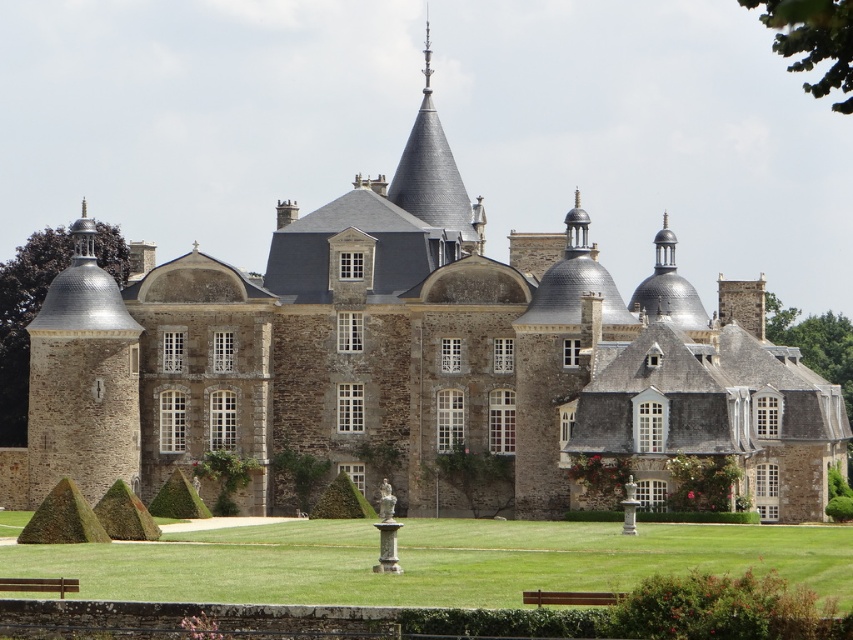
Is green leafy hedge at center to the left of brown wooden bench at lower center from the viewer's perspective?

Yes, green leafy hedge at center is to the left of brown wooden bench at lower center.

Looking at this image, who is more distant from viewer, (343, 472) or (584, 598)?

Point (343, 472)

Where is `green leafy hedge at center`? This screenshot has height=640, width=853. green leafy hedge at center is located at coordinates (341, 500).

Is brown wooden bench at lower center positioned before brown wooden bench at lower left?

Yes, brown wooden bench at lower center is closer to the viewer.

Which is above, brown wooden bench at lower center or brown wooden bench at lower left?

brown wooden bench at lower left

This screenshot has height=640, width=853. I want to click on brown wooden bench at lower center, so click(x=572, y=596).

Which of these two, green grass at center or green leafy hedge at center, stands shorter?

green grass at center is shorter.

Can you confirm if green grass at center is bigger than green leafy hedge at center?

Yes, green grass at center is bigger than green leafy hedge at center.

Who is more distant from viewer, (x=819, y=577) or (x=314, y=513)?

Result: The point (x=314, y=513) is behind.

You are a GUI agent. You are given a task and a screenshot of the screen. Output one action in this format:
    pyautogui.click(x=<x>, y=<y>)
    Task: Click on the green grass at center
    This screenshot has height=640, width=853.
    Given the screenshot: What is the action you would take?
    pyautogui.click(x=433, y=561)